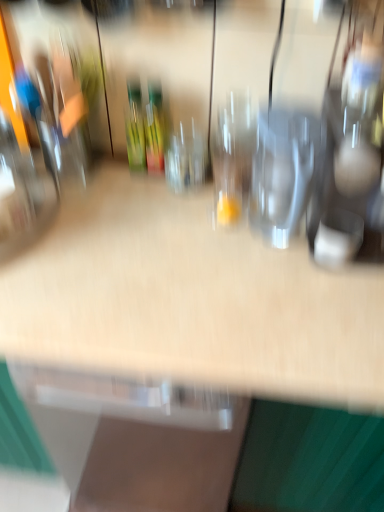
Question: In which direction should I rotate to look at transparent glass at center, which appears as the second wine glass when viewed from the left?

Choices:
 (A) right
 (B) left

Answer: (A)

Question: Is transparent glass wine glass at center, which is the 3th wine glass from right to left, turned away from transparent glass wine glass at center, acting as the third wine glass starting from the left?

Choices:
 (A) yes
 (B) no

Answer: (B)

Question: Considering the relative positions of transparent glass wine glass at center, which appears as the first wine glass when viewed from the left, and transparent glass wine glass at center, acting as the third wine glass starting from the left, in the image provided, is transparent glass wine glass at center, which appears as the first wine glass when viewed from the left, to the left of transparent glass wine glass at center, acting as the third wine glass starting from the left, from the viewer's perspective?

Choices:
 (A) no
 (B) yes

Answer: (B)

Question: From a real-world perspective, is transparent glass wine glass at center, which appears as the first wine glass when viewed from the left, located beneath transparent glass wine glass at center, acting as the third wine glass starting from the left?

Choices:
 (A) yes
 (B) no

Answer: (A)

Question: Are transparent glass wine glass at center, which appears as the first wine glass when viewed from the left, and transparent glass wine glass at center, the 1th wine glass viewed from the right, far apart?

Choices:
 (A) yes
 (B) no

Answer: (B)

Question: Could you tell me if transparent glass wine glass at center, which appears as the first wine glass when viewed from the left, is turned towards transparent glass wine glass at center, the 1th wine glass viewed from the right?

Choices:
 (A) yes
 (B) no

Answer: (B)

Question: Is transparent glass wine glass at center, which is the 3th wine glass from right to left, wider than transparent glass wine glass at center, acting as the third wine glass starting from the left?

Choices:
 (A) yes
 (B) no

Answer: (B)

Question: Is green glass bottle at center not near transparent glass at center, which appears as the second wine glass when viewed from the left?

Choices:
 (A) yes
 (B) no

Answer: (B)

Question: Considering the relative sizes of green glass bottle at center and transparent glass at center, which appears as the second wine glass when viewed from the left, in the image provided, is green glass bottle at center taller than transparent glass at center, which appears as the second wine glass when viewed from the left,?

Choices:
 (A) yes
 (B) no

Answer: (A)

Question: Is the position of green glass bottle at center less distant than that of transparent glass at center, the 2th wine glass positioned from the right?

Choices:
 (A) yes
 (B) no

Answer: (B)

Question: Is green glass bottle at center positioned beyond the bounds of transparent glass at center, the 2th wine glass positioned from the right?

Choices:
 (A) yes
 (B) no

Answer: (A)

Question: Is green glass bottle at center oriented towards transparent glass at center, the 2th wine glass positioned from the right?

Choices:
 (A) no
 (B) yes

Answer: (A)

Question: Is green glass bottle at center looking in the opposite direction of transparent glass at center, the 2th wine glass positioned from the right?

Choices:
 (A) yes
 (B) no

Answer: (B)

Question: Is transparent glass at center, which appears as the second wine glass when viewed from the left, taller than transparent glass wine glass at center, which appears as the first wine glass when viewed from the left?

Choices:
 (A) yes
 (B) no

Answer: (A)